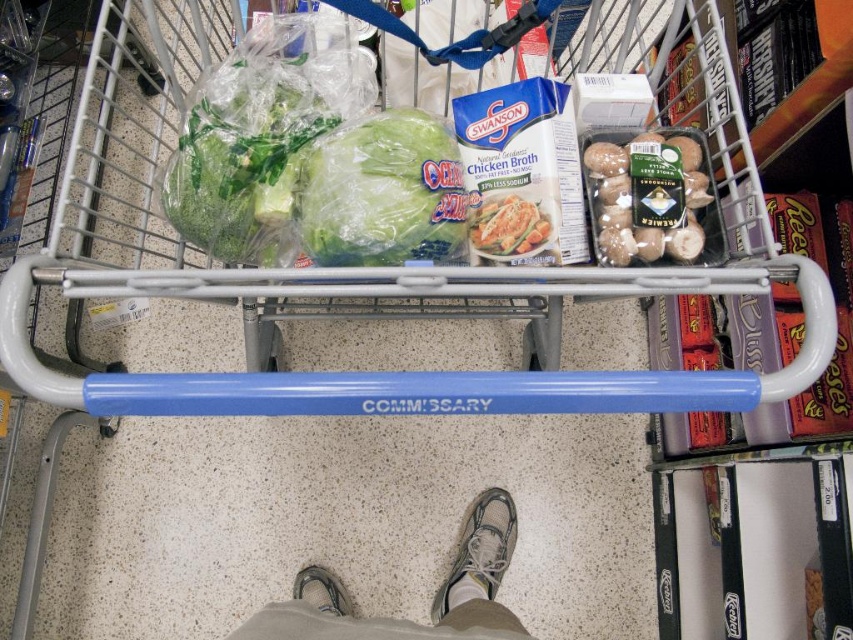
Question: Which of these objects is positioned farthest from the gray fabric shoe at lower center?

Choices:
 (A) green leafy lettuce at center
 (B) smooth brown mushrooms at center

Answer: (B)

Question: Is gray mesh shoe at lower center thinner than matte plastic chicken at center?

Choices:
 (A) yes
 (B) no

Answer: (B)

Question: Which of the following is the closest to the observer?

Choices:
 (A) matte plastic chicken at center
 (B) smooth brown mushrooms at center
 (C) green leafy lettuce at center
 (D) gray mesh shoe at lower center

Answer: (C)

Question: Which object is farther from the camera taking this photo?

Choices:
 (A) matte plastic chicken at center
 (B) smooth brown mushrooms at center

Answer: (B)

Question: Can you confirm if green leafy lettuce at center is positioned above smooth brown mushrooms at center?

Choices:
 (A) yes
 (B) no

Answer: (B)

Question: From the image, what is the correct spatial relationship of gray mesh shoe at lower center in relation to gray fabric shoe at lower center?

Choices:
 (A) right
 (B) left

Answer: (A)